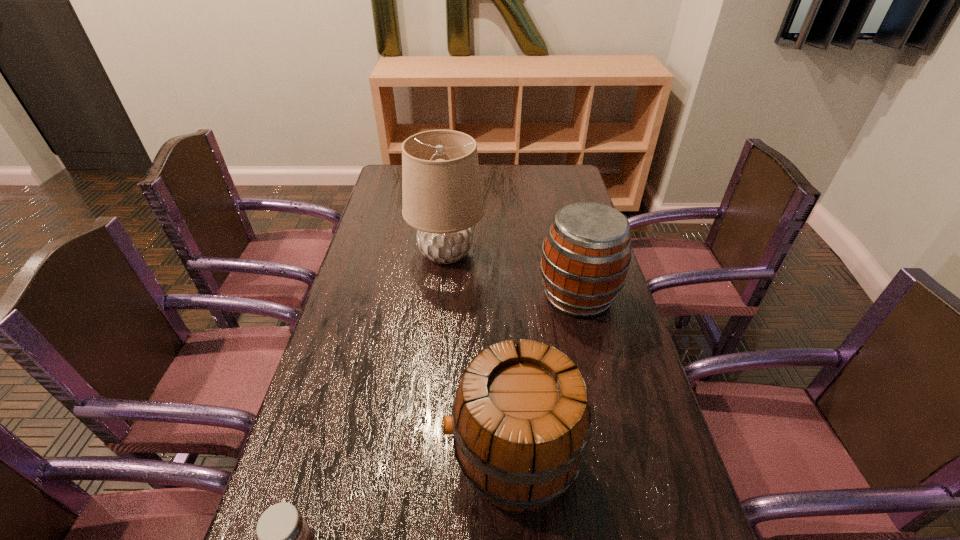
In the image, there is a desktop. Identify the location of vacant space at the left edge. (370, 436).

The height and width of the screenshot is (540, 960). Find the location of `vacant space at the right edge`. vacant space at the right edge is located at coordinates (573, 197).

You are a GUI agent. You are given a task and a screenshot of the screen. Output one action in this format:
    pyautogui.click(x=<x>, y=<y>)
    Task: Click on the vacant area that lies between the lampshade and the farther cider
    Image resolution: width=960 pixels, height=540 pixels.
    Given the screenshot: What is the action you would take?
    pyautogui.click(x=512, y=274)

Identify the location of vacant space that's between the farther cider and the lampshade. Image resolution: width=960 pixels, height=540 pixels. (512, 274).

In order to click on object that ranks as the second closest to the nearer cider in this screenshot , I will do `click(586, 255)`.

Locate which object is the second closest to the shortest object. Please provide its 2D coordinates. Your answer should be formatted as a tuple, i.e. [(x, y)], where the tuple contains the x and y coordinates of a point satisfying the conditions above.

[(586, 255)]

Locate an element on the screen. Image resolution: width=960 pixels, height=540 pixels. vacant space that satisfies the following two spatial constraints: 1. on the front side of the farther cider; 2. on the left side of the tallest object is located at coordinates (443, 295).

This screenshot has height=540, width=960. In order to click on vacant region that satisfies the following two spatial constraints: 1. on the front side of the farther cider; 2. on the right side of the lampshade in this screenshot , I will do `click(443, 295)`.